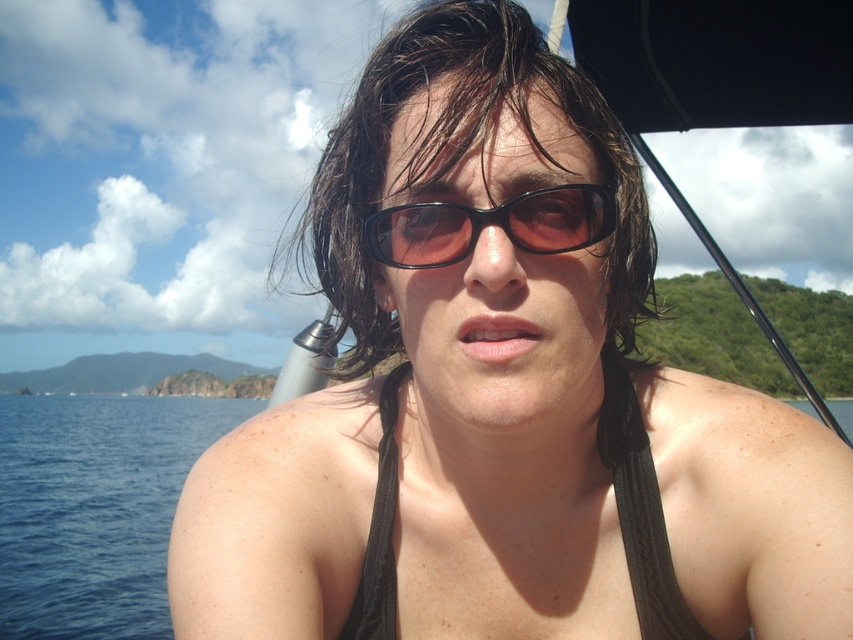
Question: Which object is the closest to the black plastic sunglasses at center?

Choices:
 (A) wet dark brown hair at center
 (B) black fabric bikini top at center

Answer: (A)

Question: Which object appears closest to the camera in this image?

Choices:
 (A) blue water at lower left
 (B) black fabric bikini top at center
 (C) wet dark brown hair at center
 (D) black plastic sunglasses at center

Answer: (D)

Question: Is wet dark brown hair at center positioned at the back of black fabric bikini top at center?

Choices:
 (A) yes
 (B) no

Answer: (B)

Question: Does blue water at lower left have a greater width compared to black plastic sunglasses at center?

Choices:
 (A) no
 (B) yes

Answer: (B)

Question: Which point is farther to the camera?

Choices:
 (A) (54, 449)
 (B) (445, 220)

Answer: (A)

Question: Can you confirm if wet dark brown hair at center is positioned to the right of transparent water at center?

Choices:
 (A) yes
 (B) no

Answer: (A)